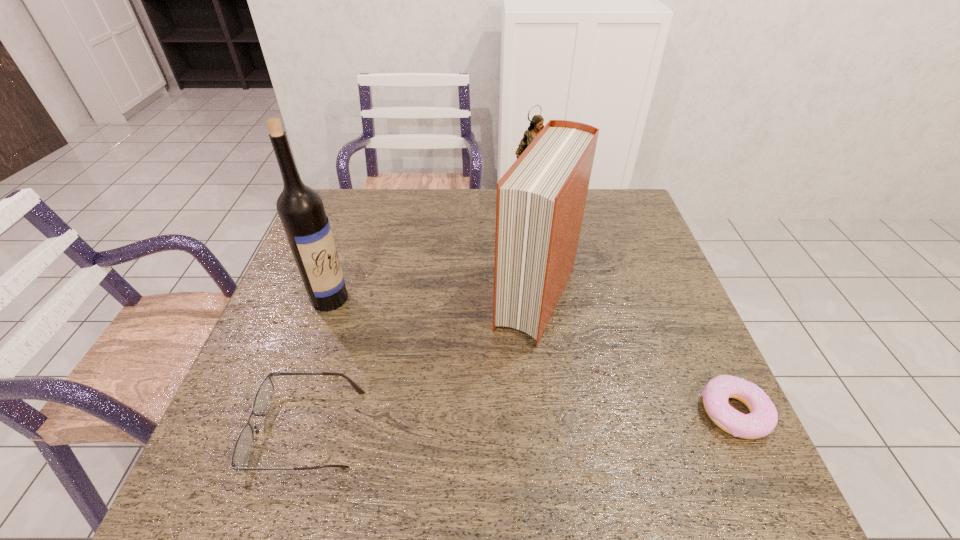
Locate an element on the screen. vacant point located between the second tallest object and the spectacles is located at coordinates (421, 363).

At what (x,y) coordinates should I click in order to perform the action: click on the closest object to the spectacles. Please return your answer as a coordinate pair (x, y). The height and width of the screenshot is (540, 960). Looking at the image, I should click on (300, 208).

The width and height of the screenshot is (960, 540). What are the coordinates of `object identified as the third closest to the wine bottle` in the screenshot? It's located at (536, 125).

The width and height of the screenshot is (960, 540). What are the coordinates of `blank space that satisfies the following two spatial constraints: 1. on the front side of the rightmost object; 2. on the left side of the figurine` in the screenshot? It's located at (564, 413).

Find the location of a particular element. The image size is (960, 540). blank space that satisfies the following two spatial constraints: 1. on the back side of the farthest object; 2. on the right side of the second tallest object is located at coordinates (524, 209).